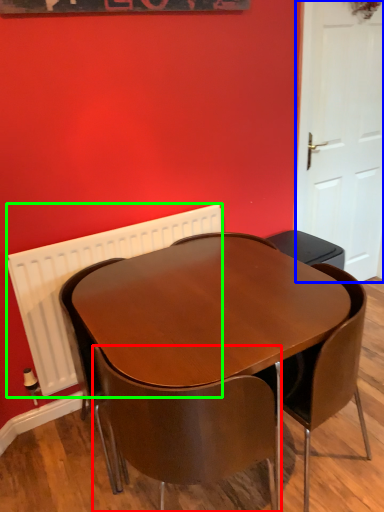
Question: Which object is the farthest from chair (highlighted by a red box)? Choose among these: door (highlighted by a blue box) or radiator (highlighted by a green box).

Choices:
 (A) door
 (B) radiator

Answer: (A)